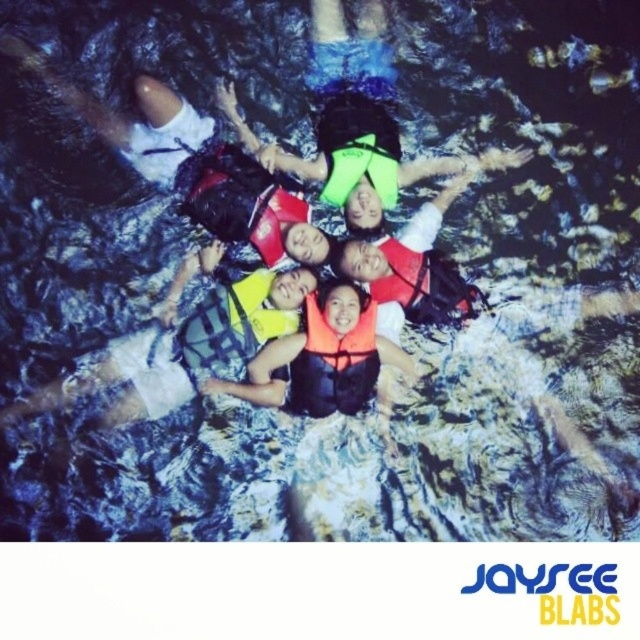
Question: Estimate the real-world distances between objects in this image. Which object is farther from the orange life vest at center?

Choices:
 (A) yellow life vest at center
 (B) neon green life jacket at center
 (C) neon yellow life jacket at center

Answer: (B)

Question: Can you confirm if orange life vest at center is wider than orange matte life jacket at center?

Choices:
 (A) yes
 (B) no

Answer: (A)

Question: Which of these objects is positioned farthest from the neon green life jacket at center?

Choices:
 (A) orange matte life jacket at center
 (B) orange life jacket at center
 (C) yellow life vest at center

Answer: (A)

Question: From the image, what is the correct spatial relationship of neon yellow life jacket at center in relation to orange life jacket at center?

Choices:
 (A) right
 (B) left

Answer: (B)

Question: Which object is closer to the camera taking this photo?

Choices:
 (A) yellow life vest at center
 (B) orange life vest at center

Answer: (B)

Question: Can you confirm if orange soft life jacket at center is positioned to the left of orange life jacket at center?

Choices:
 (A) no
 (B) yes

Answer: (A)